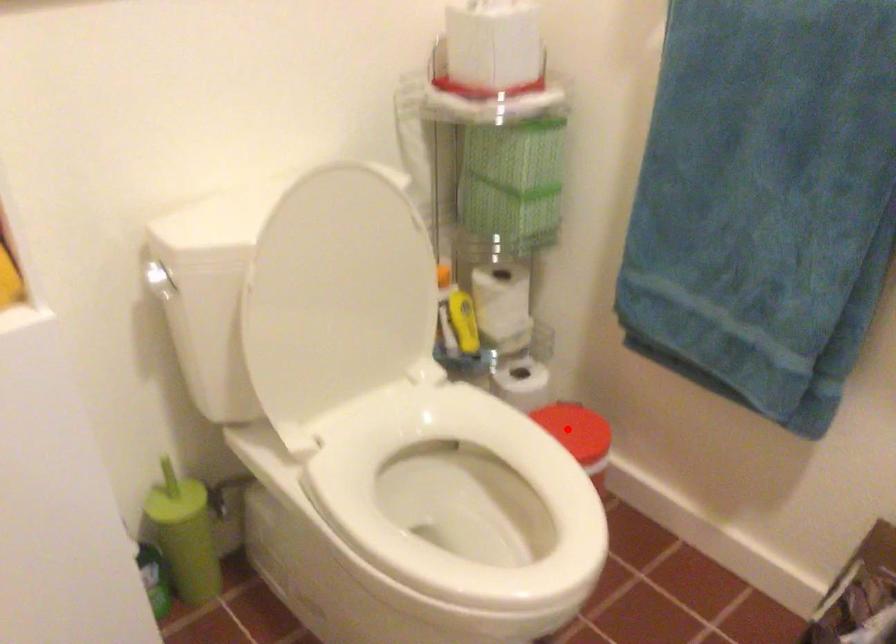
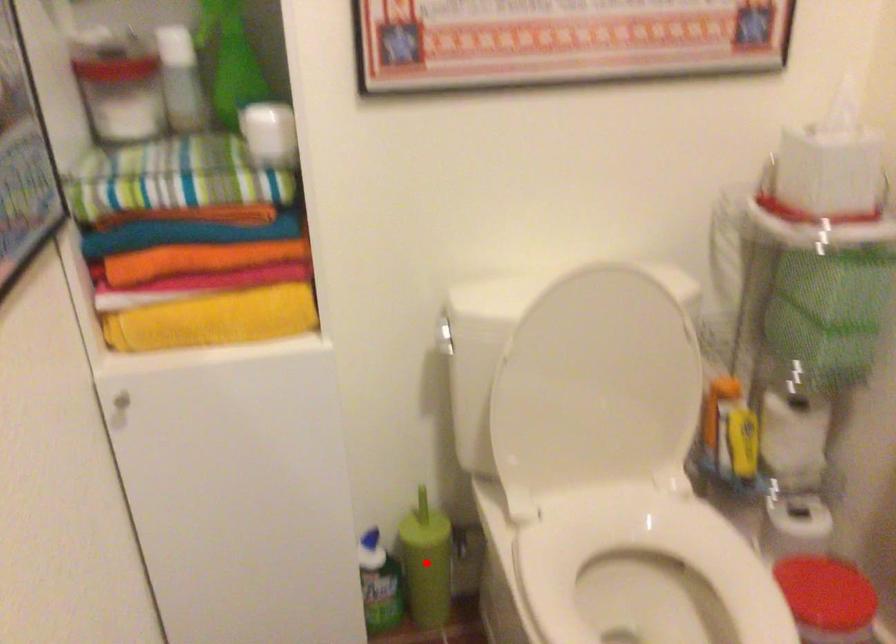
I am providing you with two images of the same scene from different viewpoints. A red point is marked on the first image and another point is marked on the second image. Does the point marked in image1 correspond to the same location as the one in image2?

No